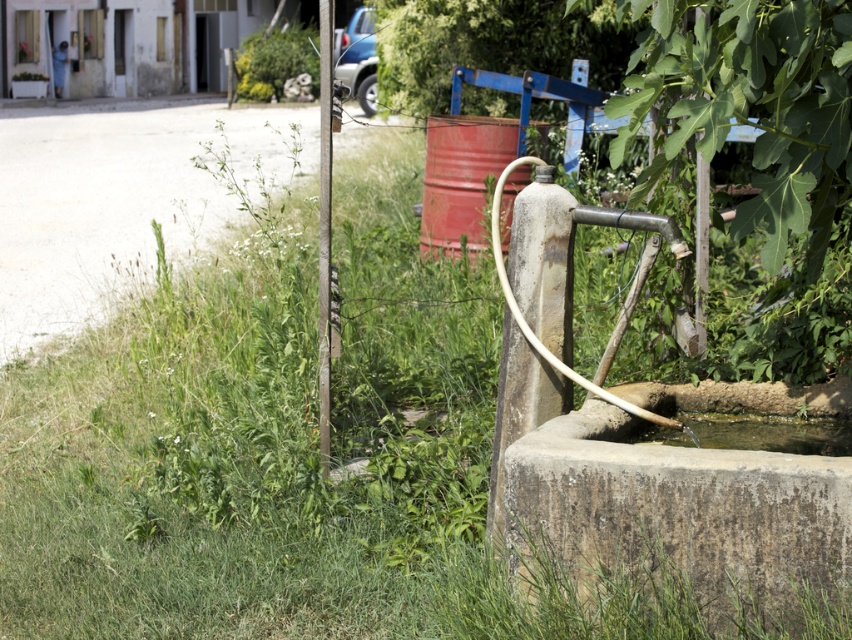
Question: Can you confirm if rusty metal barrel at center is wider than clear water at lower center?

Choices:
 (A) yes
 (B) no

Answer: (A)

Question: Among these objects, which one is farthest from the camera?

Choices:
 (A) gray concrete fountain at lower right
 (B) rusty metal barrel at center
 (C) clear water at lower center

Answer: (B)

Question: Is rusty metal barrel at center thinner than clear water at lower center?

Choices:
 (A) yes
 (B) no

Answer: (B)

Question: From the image, what is the correct spatial relationship of gray concrete fountain at lower right in relation to clear water at lower center?

Choices:
 (A) right
 (B) left

Answer: (B)

Question: Which object is positioned closest to the clear water at lower center?

Choices:
 (A) rusty metal barrel at center
 (B) gray concrete fountain at lower right

Answer: (B)

Question: Which object is the closest to the gray concrete fountain at lower right?

Choices:
 (A) rusty metal barrel at center
 (B) clear water at lower center

Answer: (B)